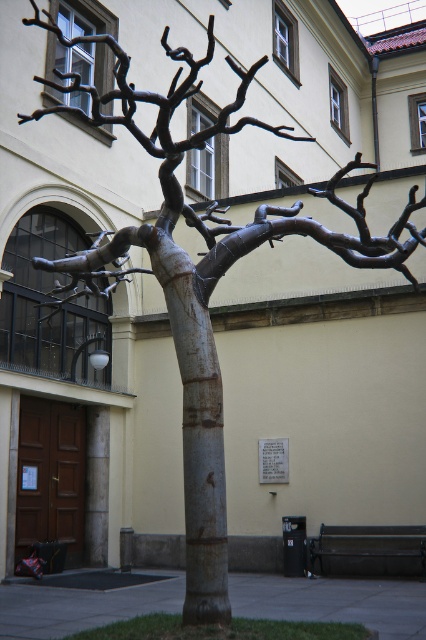
In the scene shown: Is rustic wood tree trunk at center closer to camera compared to polished bronze branch at center?

Yes.

Is rustic wood tree trunk at center thinner than polished bronze branch at center?

Correct, rustic wood tree trunk at center's width is less than polished bronze branch at center's.

Between point (183, 288) and point (221, 253), which one is positioned in front?

Point (183, 288)

Where is `rustic wood tree trunk at center`? The image size is (426, 640). rustic wood tree trunk at center is located at coordinates (196, 433).